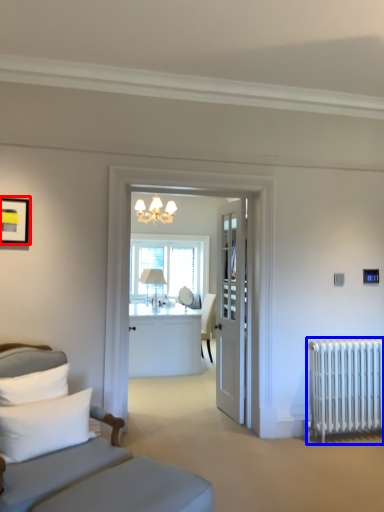
Question: Which point is further to the camera, picture frame (highlighted by a red box) or radiator (highlighted by a blue box)?

Choices:
 (A) picture frame
 (B) radiator

Answer: (B)